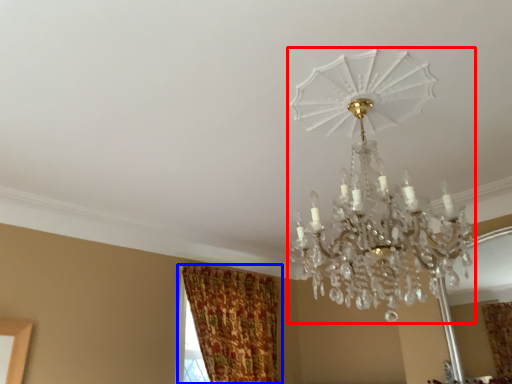
Question: Among these objects, which one is nearest to the camera, lamp (highlighted by a red box) or curtain (highlighted by a blue box)?

Choices:
 (A) lamp
 (B) curtain

Answer: (A)